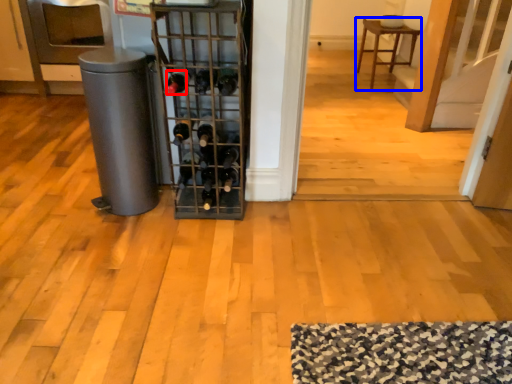
Question: Among these objects, which one is farthest to the camera, wine bottle (highlighted by a red box) or furniture (highlighted by a blue box)?

Choices:
 (A) wine bottle
 (B) furniture

Answer: (B)